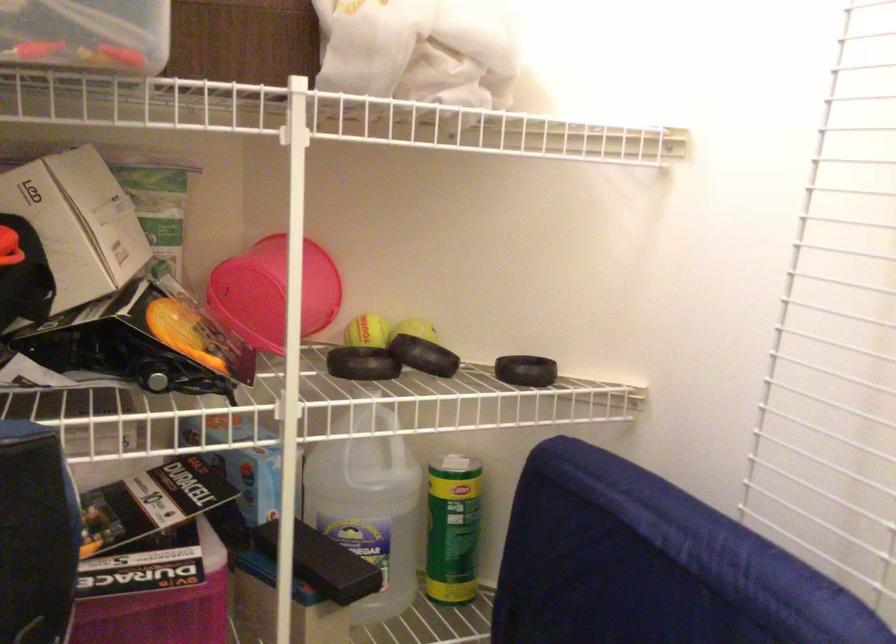
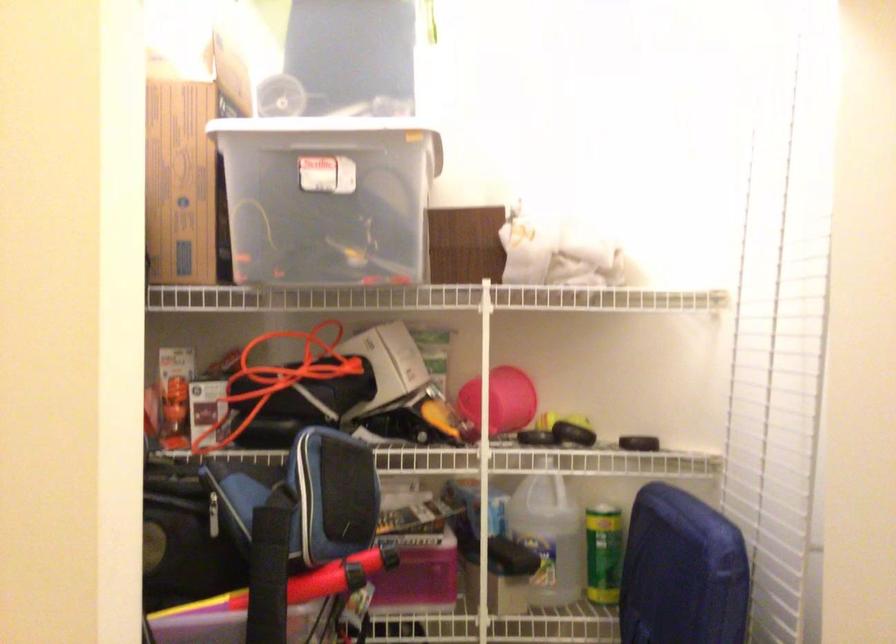
Where in the second image is the point corresponding to [382,520] from the first image?

(548, 536)